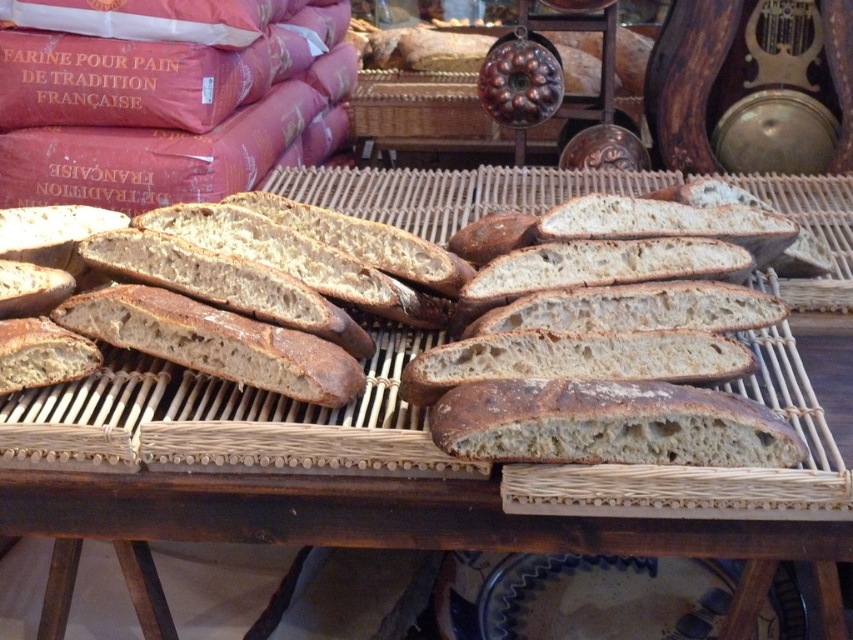
Question: Is brown matte baguette at center thinner than brown crusty loaf of bread at center?

Choices:
 (A) no
 (B) yes

Answer: (A)

Question: Which of the following is the closest to the observer?

Choices:
 (A) brown crusty loaf of bread at center
 (B) brown matte baguette at center

Answer: (A)

Question: Which of the following is the closest to the observer?

Choices:
 (A) brown crusty loaf of bread at center
 (B) brown matte baguette at center

Answer: (A)

Question: Is brown matte baguette at center bigger than brown crusty loaf of bread at center?

Choices:
 (A) no
 (B) yes

Answer: (B)

Question: Among these objects, which one is farthest from the camera?

Choices:
 (A) brown matte baguette at center
 (B) brown crusty loaf of bread at center

Answer: (A)

Question: Observing the image, what is the correct spatial positioning of brown matte baguette at center in reference to brown crusty loaf of bread at center?

Choices:
 (A) below
 (B) above

Answer: (B)